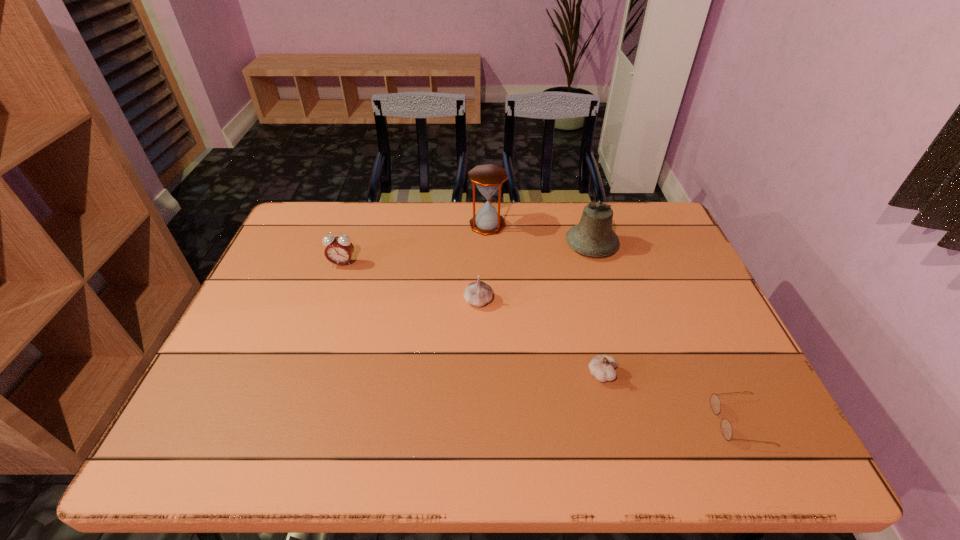
You are a GUI agent. You are given a task and a screenshot of the screen. Output one action in this format:
    pyautogui.click(x=<x>, y=<y>)
    Task: Click on the hourglass
    The image size is (960, 540).
    Given the screenshot: What is the action you would take?
    pyautogui.click(x=488, y=178)

Find the location of a particular element. the second tallest object is located at coordinates click(593, 236).

The height and width of the screenshot is (540, 960). I want to click on the leftmost object, so click(x=339, y=250).

At what (x,y) coordinates should I click in order to perform the action: click on alarm clock. Please return your answer as a coordinate pair (x, y). Looking at the image, I should click on (339, 250).

Locate an element on the screen. the third nearest object is located at coordinates (478, 293).

This screenshot has height=540, width=960. Identify the location of the left garlic. (478, 293).

In order to click on the nearer garlic in this screenshot , I will do `click(601, 367)`.

This screenshot has width=960, height=540. I want to click on the right garlic, so click(601, 367).

Identify the location of the shortest object. (726, 428).

What are the coordinates of `the rightmost object` in the screenshot? It's located at (726, 428).